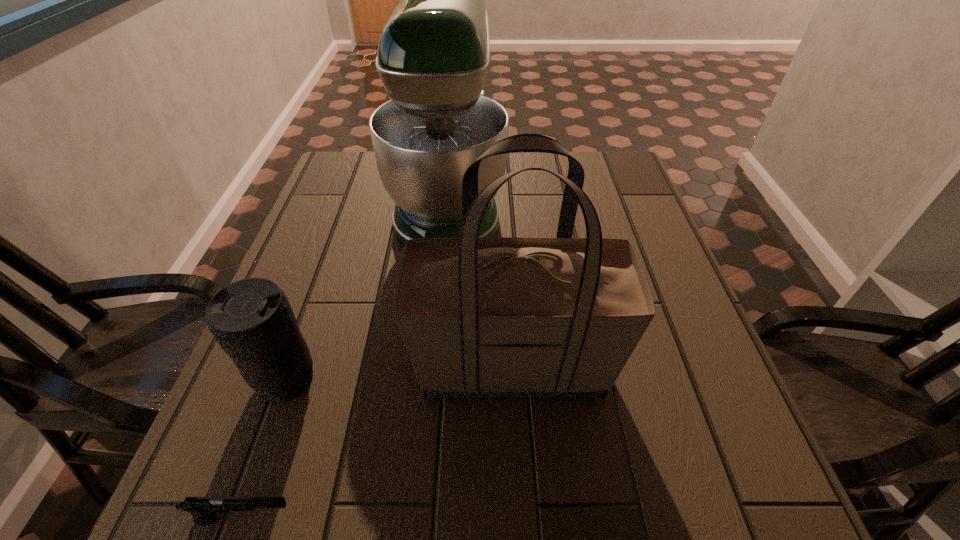
Point out which object is positioned as the nearest to the shopping bag. Please provide its 2D coordinates. Your answer should be formatted as a tuple, i.e. [(x, y)], where the tuple contains the x and y coordinates of a point satisfying the conditions above.

[(251, 319)]

The width and height of the screenshot is (960, 540). Find the location of `the third closest object relative to the telephoto lens`. the third closest object relative to the telephoto lens is located at coordinates (432, 58).

The height and width of the screenshot is (540, 960). What are the coordinates of `vacant space that satisfies the following two spatial constraints: 1. on the controls of the mixer; 2. on the side of the third tallest object where the control switches are located` in the screenshot? It's located at [433, 380].

I want to click on free space that satisfies the following two spatial constraints: 1. with handles facing forward on the shopping bag; 2. on the side of the third tallest object where the control switches are located, so (x=514, y=380).

Identify the location of vacant region that satisfies the following two spatial constraints: 1. with handles facing forward on the shopping bag; 2. on the side of the third tallest object where the control switches are located. (514, 380).

At what (x,y) coordinates should I click in order to perform the action: click on vacant region that satisfies the following two spatial constraints: 1. with handles facing forward on the shopping bag; 2. on the side of the telephoto lens where the control switches are located. Please return your answer as a coordinate pair (x, y). The width and height of the screenshot is (960, 540). Looking at the image, I should click on [514, 380].